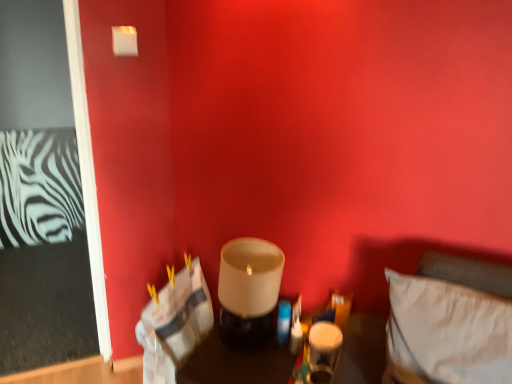
Where is `vacant area situated to the left side of matte white glass at lower center, the first candle holder in the right-to-left sequence`? The image size is (512, 384). vacant area situated to the left side of matte white glass at lower center, the first candle holder in the right-to-left sequence is located at coordinates (270, 363).